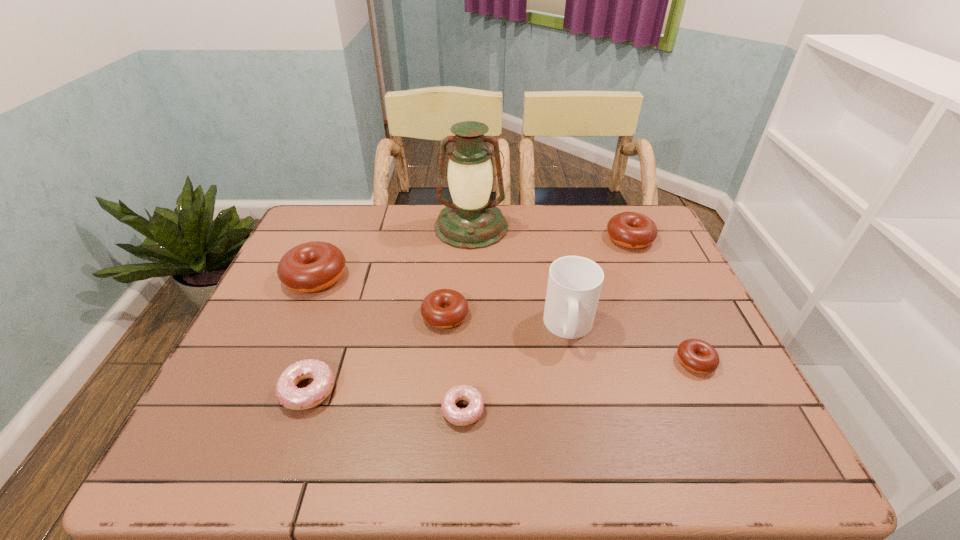
At what (x,y) coordinates should I click in order to perform the action: click on free spot between the farthest chocolate doughnut and the tallest doughnut. Please return your answer as a coordinate pair (x, y). The height and width of the screenshot is (540, 960). Looking at the image, I should click on (472, 258).

Locate an element on the screen. The height and width of the screenshot is (540, 960). free area in between the lantern and the mug is located at coordinates (520, 277).

The height and width of the screenshot is (540, 960). Identify the location of free space between the tallest object and the farthest doughnut. (550, 233).

You are a GUI agent. You are given a task and a screenshot of the screen. Output one action in this format:
    pyautogui.click(x=<x>, y=<y>)
    Task: Click on the unoccupied position between the second farthest doughnut and the second chocolate doughnut from left to right
    The image size is (960, 540).
    Given the screenshot: What is the action you would take?
    point(380,296)

Locate an element on the screen. empty space between the sixth nearest object and the bigger pink doughnut is located at coordinates (312, 334).

I want to click on vacant space that's between the second farthest chocolate doughnut and the farthest doughnut, so (472, 258).

Locate an element on the screen. This screenshot has height=540, width=960. vacant point located between the tallest object and the sixth object from left to right is located at coordinates (520, 277).

At what (x,y) coordinates should I click in order to perform the action: click on object that is the fifth closest to the second nearest chocolate doughnut. Please return your answer as a coordinate pair (x, y). The image size is (960, 540). Looking at the image, I should click on (309, 267).

Locate which object ranks sixth in proximity to the nearest chocolate doughnut. Please provide its 2D coordinates. Your answer should be formatted as a tuple, i.e. [(x, y)], where the tuple contains the x and y coordinates of a point satisfying the conditions above.

[(290, 396)]

Image resolution: width=960 pixels, height=540 pixels. What are the coordinates of `doughnut identified as the closest to the smaller pink doughnut` in the screenshot? It's located at (444, 308).